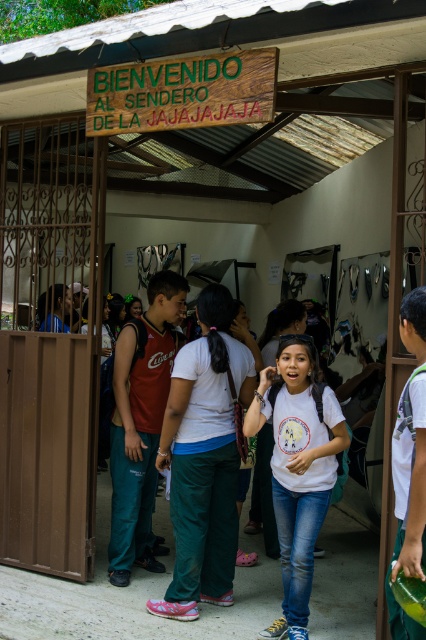
Question: Is white matte shirt at center below matte red tank top at center?

Choices:
 (A) no
 (B) yes

Answer: (B)

Question: Which of the following is the closest to the observer?

Choices:
 (A) white matte shirt at center
 (B) matte red tank top at center

Answer: (A)

Question: Does white matte shirt at center lie behind matte red tank top at center?

Choices:
 (A) yes
 (B) no

Answer: (B)

Question: Is white matte shirt at center smaller than matte red tank top at center?

Choices:
 (A) yes
 (B) no

Answer: (A)